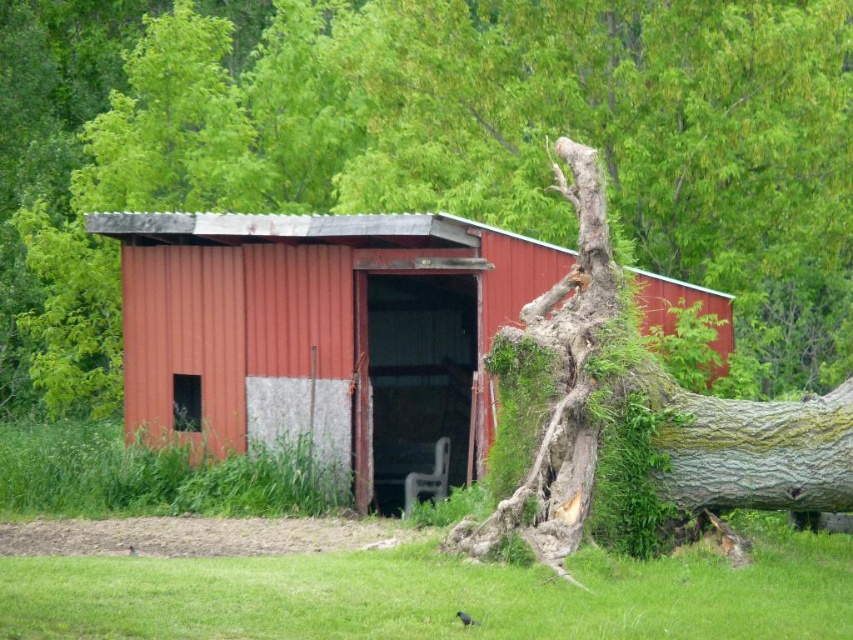
Question: Is grayish-brown bark tree at center smaller than rustic corrugated metal barn at center?

Choices:
 (A) yes
 (B) no

Answer: (B)

Question: Among these points, which one is nearest to the camera?

Choices:
 (A) (851, 20)
 (B) (477, 364)

Answer: (A)

Question: Which object is farther from the camera taking this photo?

Choices:
 (A) rustic corrugated metal barn at center
 (B) grayish-brown bark tree at center

Answer: (A)

Question: Where is grayish-brown bark tree at center located in relation to rustic corrugated metal barn at center in the image?

Choices:
 (A) above
 (B) below

Answer: (A)

Question: Which of the following is the farthest from the observer?

Choices:
 (A) (270, 408)
 (B) (792, 384)

Answer: (B)

Question: Is grayish-brown bark tree at center smaller than rustic corrugated metal barn at center?

Choices:
 (A) no
 (B) yes

Answer: (A)